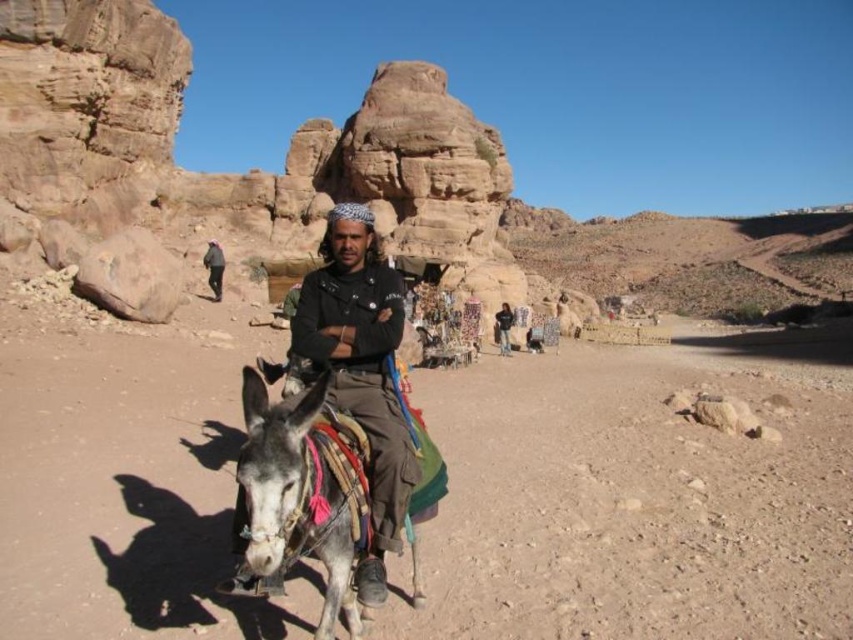
Consider the image. Does black matte shirt at center appear on the right side of dark blue fabric at center?

No, black matte shirt at center is not to the right of dark blue fabric at center.

Who is positioned more to the right, black matte shirt at center or dark blue fabric at center?

dark blue fabric at center is more to the right.

What do you see at coordinates (361, 369) in the screenshot? Image resolution: width=853 pixels, height=640 pixels. I see `black matte shirt at center` at bounding box center [361, 369].

I want to click on black matte shirt at center, so click(x=361, y=369).

Is black matte shirt at center positioned in front of dark brown leather jacket at center?

Yes, black matte shirt at center is in front of dark brown leather jacket at center.

Which is in front, point (405, 486) or point (221, 259)?

Point (405, 486) is more forward.

Does point (370, 593) lie in front of point (202, 260)?

Yes, point (370, 593) is closer to viewer.

The height and width of the screenshot is (640, 853). I want to click on black matte shirt at center, so click(361, 369).

Does gray textured donkey at center have a smaller size compared to dark blue fabric at center?

No.

Which is more to the right, gray textured donkey at center or dark blue fabric at center?

dark blue fabric at center

Who is more forward, (302, 461) or (496, 317)?

Point (302, 461) is in front.

This screenshot has height=640, width=853. I want to click on gray textured donkey at center, so click(x=305, y=492).